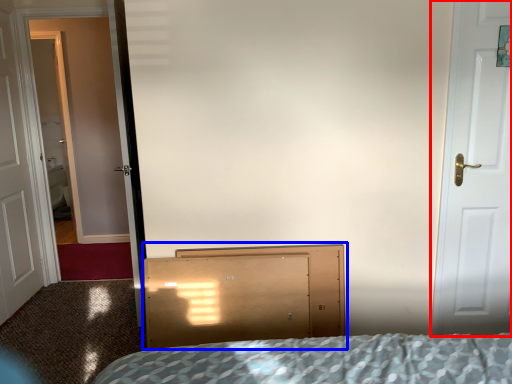
Question: Which point is further to the camera, door (highlighted by a red box) or dresser (highlighted by a blue box)?

Choices:
 (A) door
 (B) dresser

Answer: (B)